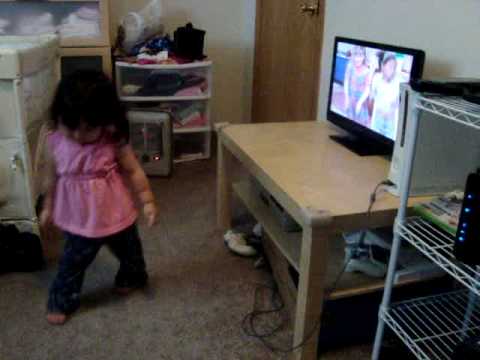
I want to click on controller wire, so click(x=371, y=211).